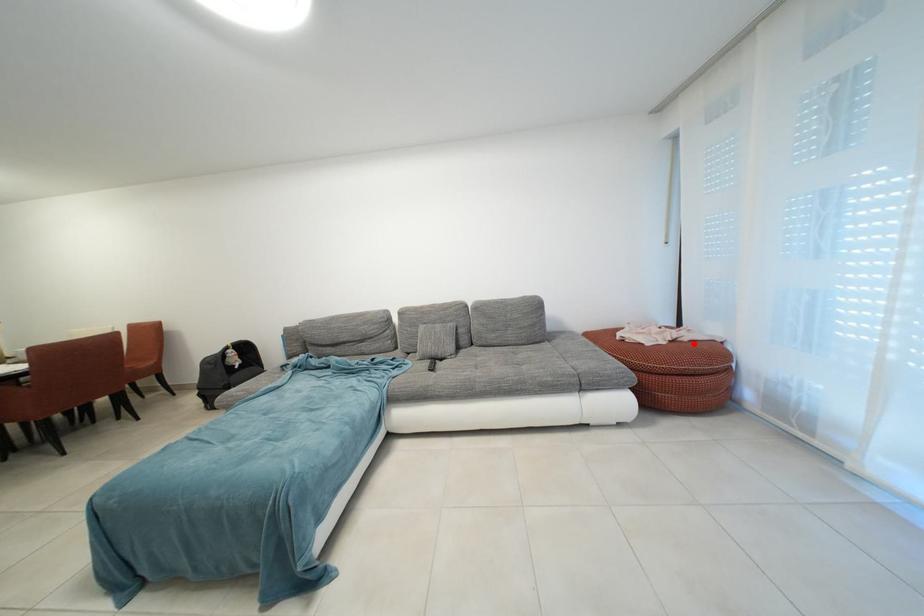
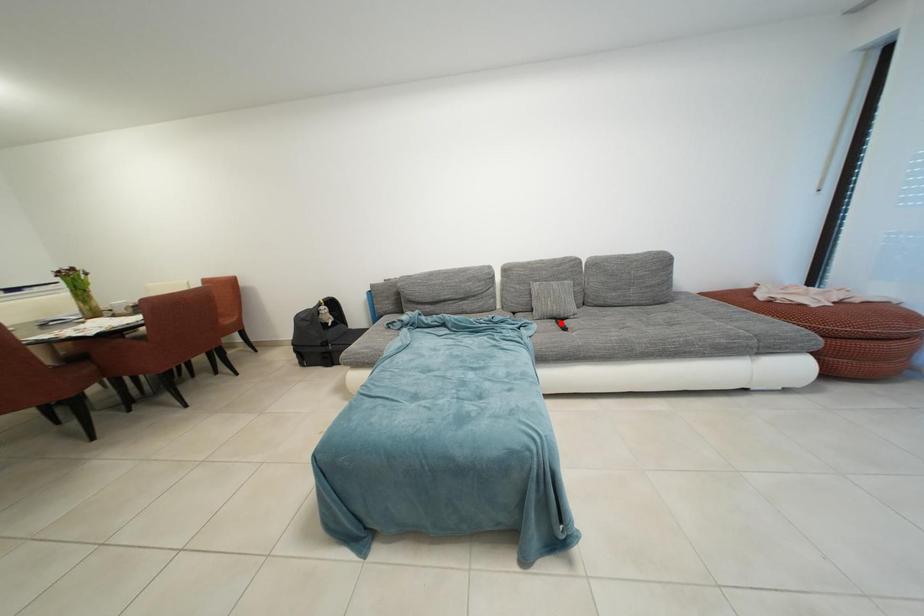
I am providing you with two images of the same scene from different viewpoints. A red point is marked on the first image and another point is marked on the second image. Does the point marked in image1 correspond to the same location as the one in image2?

No